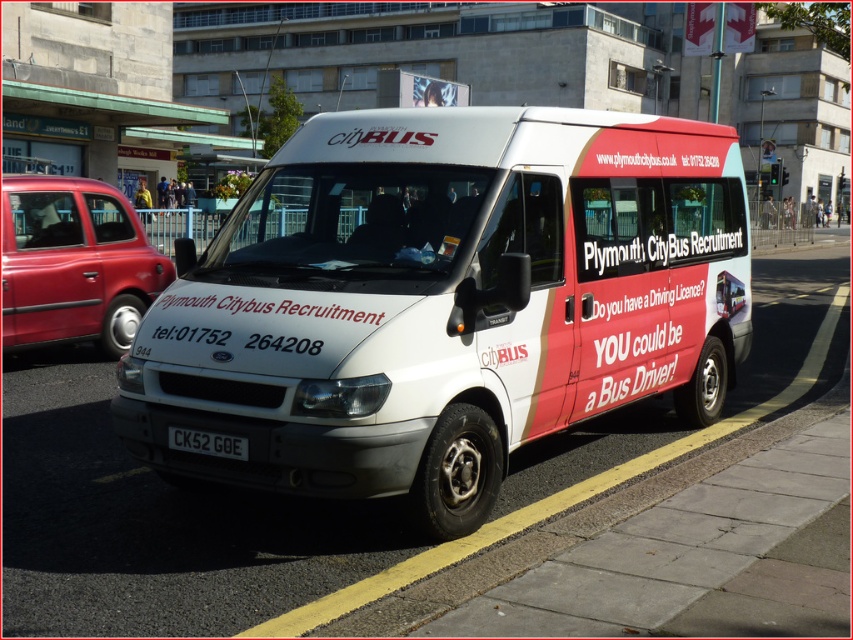
Question: Which object is farther from the camera taking this photo?

Choices:
 (A) metallic red taxi at left
 (B) black plastic license plate at center
 (C) white matte van at center
 (D) yellow painted curb at lower center

Answer: (A)

Question: Can you confirm if white matte van at center is positioned below yellow painted curb at lower center?

Choices:
 (A) no
 (B) yes

Answer: (A)

Question: Among these objects, which one is nearest to the camera?

Choices:
 (A) yellow painted curb at lower center
 (B) white matte van at center
 (C) black plastic license plate at center
 (D) metallic red taxi at left

Answer: (A)

Question: Does metallic red taxi at left have a smaller size compared to yellow painted curb at lower center?

Choices:
 (A) no
 (B) yes

Answer: (B)

Question: Where is metallic red taxi at left located in relation to yellow painted curb at lower center in the image?

Choices:
 (A) left
 (B) right

Answer: (A)

Question: Which object is the closest to the yellow painted curb at lower center?

Choices:
 (A) metallic red taxi at left
 (B) black plastic license plate at center
 (C) white matte van at center

Answer: (C)